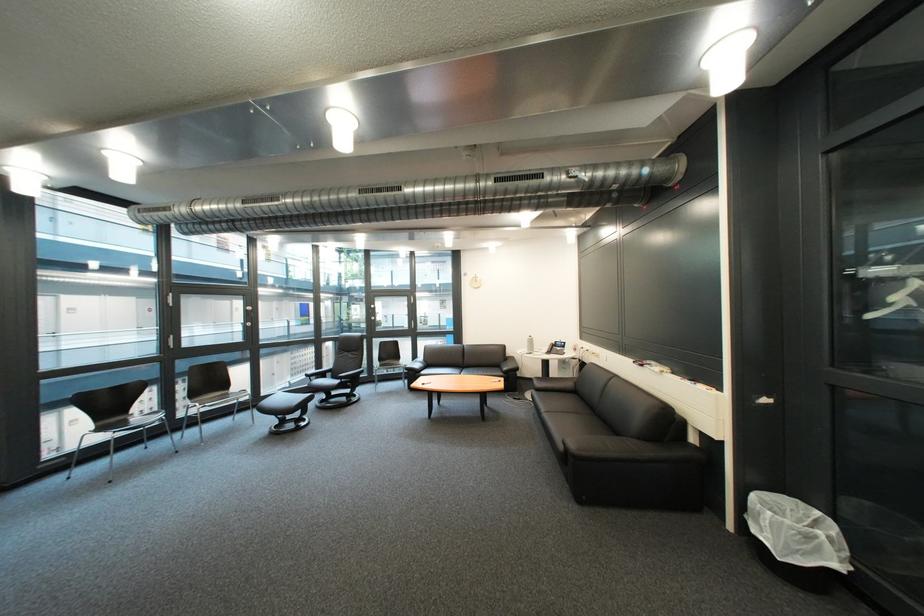
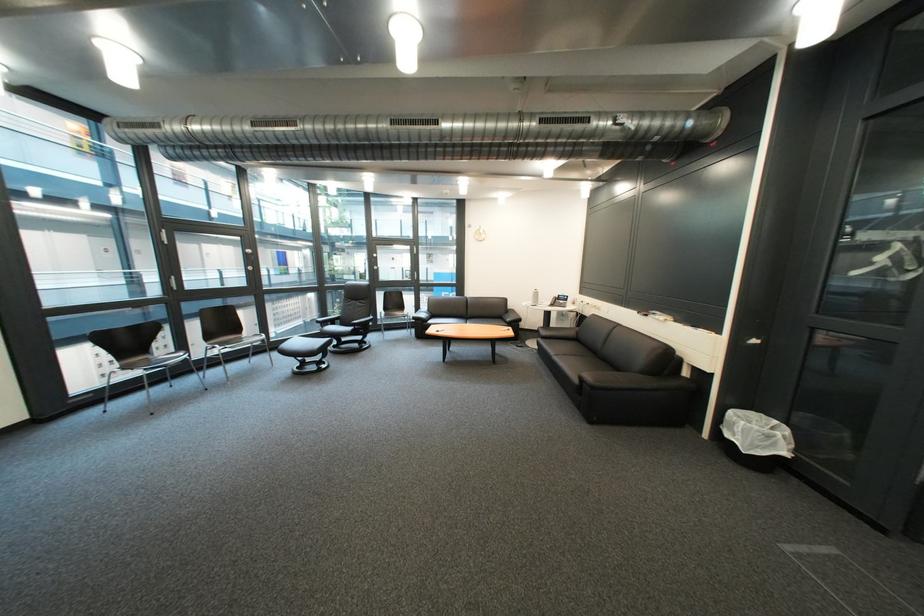
The point at (295, 400) is marked in the first image. Where is the corresponding point in the second image?

(311, 345)